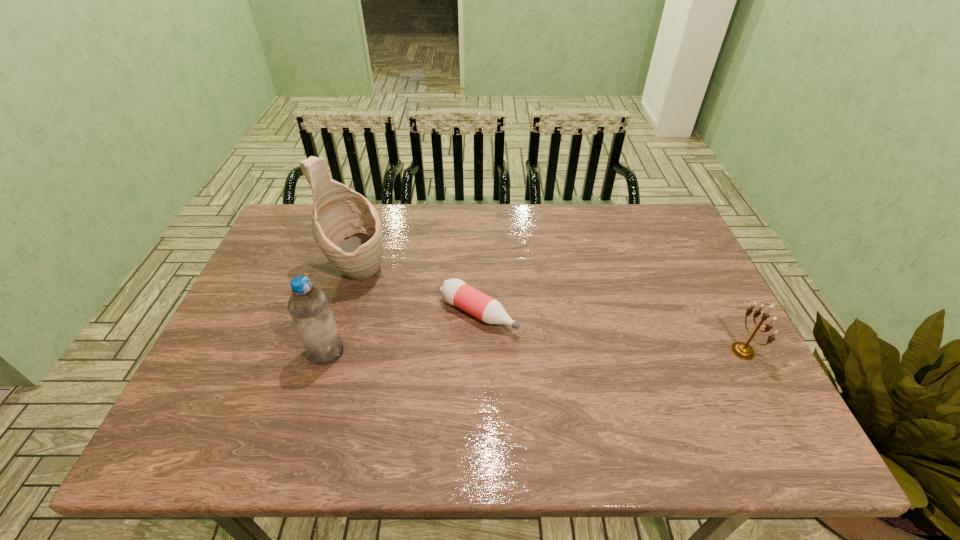
I want to click on object that is the third nearest to the shortest object, so click(744, 351).

Identify which object is located as the nearest to the pitcher. Please provide its 2D coordinates. Your answer should be formatted as a tuple, i.e. [(x, y)], where the tuple contains the x and y coordinates of a point satisfying the conditions above.

[(309, 308)]

Where is `vacant area that satisfies the following two spatial constraints: 1. on the back side of the third shortest object; 2. on the left side of the tallest object`? The image size is (960, 540). vacant area that satisfies the following two spatial constraints: 1. on the back side of the third shortest object; 2. on the left side of the tallest object is located at coordinates (350, 273).

Where is `free space that satisfies the following two spatial constraints: 1. on the back side of the candelabrum; 2. on the right side of the third shortest object`? The height and width of the screenshot is (540, 960). free space that satisfies the following two spatial constraints: 1. on the back side of the candelabrum; 2. on the right side of the third shortest object is located at coordinates (326, 351).

Locate an element on the screen. This screenshot has width=960, height=540. vacant space that satisfies the following two spatial constraints: 1. on the front side of the pitcher; 2. on the right side of the rightmost object is located at coordinates (334, 351).

Where is `free space that satisfies the following two spatial constraints: 1. on the back side of the tallest object; 2. on the right side of the third shortest object`? The height and width of the screenshot is (540, 960). free space that satisfies the following two spatial constraints: 1. on the back side of the tallest object; 2. on the right side of the third shortest object is located at coordinates (350, 273).